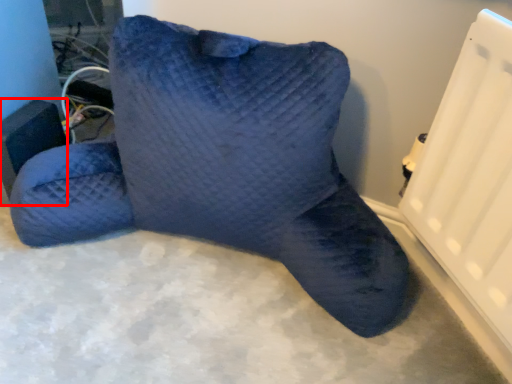
Question: From the image's perspective, where is speaker (annotated by the red box) located in relation to furniture in the image?

Choices:
 (A) above
 (B) below

Answer: (B)